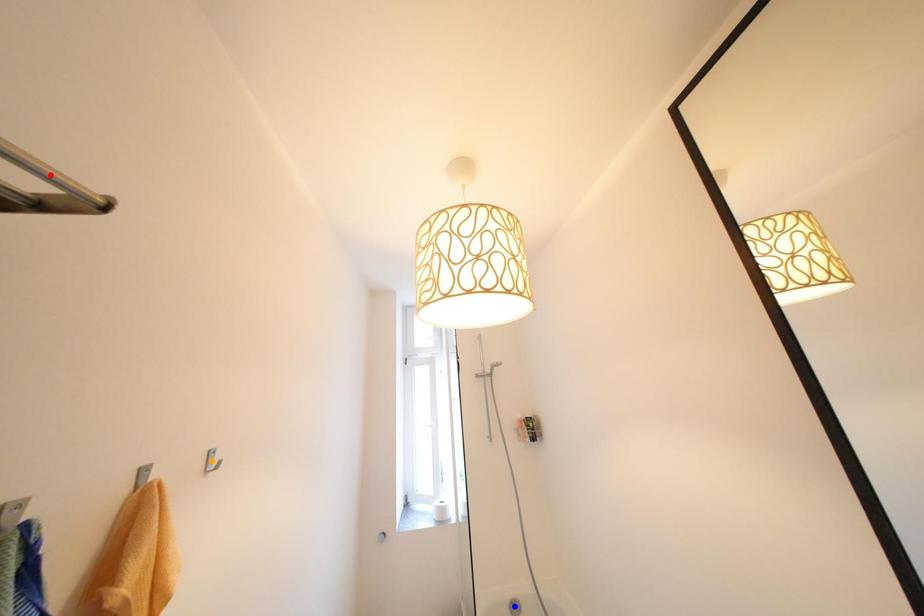
Order these from nearest to farthest:
- orange point
- blue point
- red point

1. red point
2. orange point
3. blue point